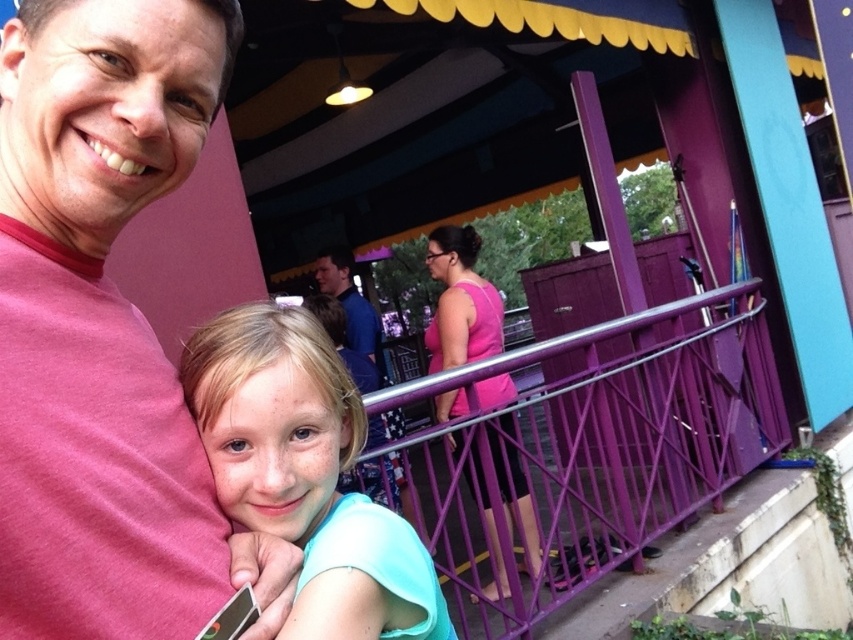
You are a photographer trying to capture a photo of the purple metallic railing at center and the pink fabric dress at center. Since you want to ensure both are clearly visible, which object should you focus on first to account for their sizes?

The purple metallic railing at center is larger in size than the pink fabric dress at center, so you should focus on the purple metallic railing at center first because its larger size may require more precise focusing to ensure clarity.

You are a photographer at the amusement park and need to ensure both the light blue fabric at center and the pink fabric dress at center are fully visible in your shot. Which object should you focus on to avoid cropping the other?

The light blue fabric at center occupies less space than the pink fabric dress at center, so focusing on the pink fabric dress at center ensures both are fully visible without cropping.

Based on the photo, you are standing in the amusement park scene and want to know which of the two points, point (733,353) or point (450,300), is closer to you. Can you determine this based on their positions?

Point (733,353) is further to the camera than point (450,300), so the closer point to you is point (450,300).